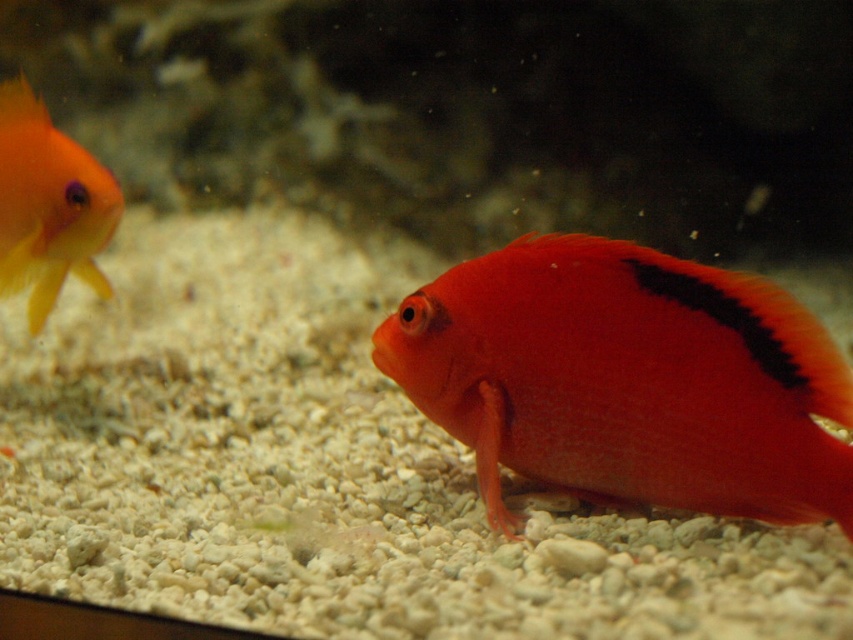
Question: Is shiny orange fish at center wider than matte orange goldfish at left?

Choices:
 (A) yes
 (B) no

Answer: (A)

Question: Which point is farther from the camera taking this photo?

Choices:
 (A) (590, 388)
 (B) (18, 232)

Answer: (B)

Question: Which object is closer to the camera taking this photo?

Choices:
 (A) shiny orange fish at center
 (B) matte orange goldfish at left

Answer: (A)

Question: Does shiny orange fish at center appear under matte orange goldfish at left?

Choices:
 (A) no
 (B) yes

Answer: (B)

Question: Is shiny orange fish at center above matte orange goldfish at left?

Choices:
 (A) yes
 (B) no

Answer: (B)